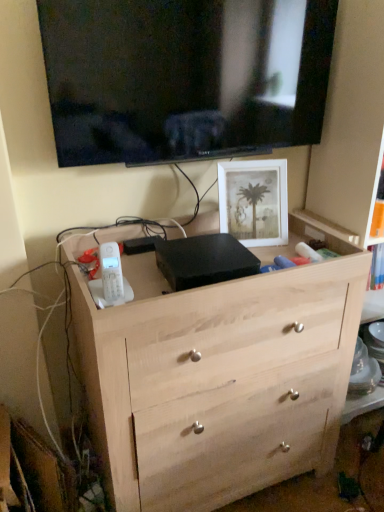
Question: Considering the relative sizes of natural wood chest of drawers at center and white matte picture frame at upper right in the image provided, is natural wood chest of drawers at center bigger than white matte picture frame at upper right?

Choices:
 (A) no
 (B) yes

Answer: (B)

Question: Is natural wood chest of drawers at center positioned with its back to white matte picture frame at upper right?

Choices:
 (A) no
 (B) yes

Answer: (A)

Question: Does natural wood chest of drawers at center have a greater height compared to white matte picture frame at upper right?

Choices:
 (A) yes
 (B) no

Answer: (A)

Question: Is natural wood chest of drawers at center aimed at white matte picture frame at upper right?

Choices:
 (A) yes
 (B) no

Answer: (B)

Question: From a real-world perspective, is natural wood chest of drawers at center over white matte picture frame at upper right?

Choices:
 (A) no
 (B) yes

Answer: (A)

Question: Based on their positions, is white matte picture frame at upper right located to the left or right of black glossy tv at upper center?

Choices:
 (A) left
 (B) right

Answer: (B)

Question: Considering the positions of white matte picture frame at upper right and black glossy tv at upper center in the image, is white matte picture frame at upper right wider or thinner than black glossy tv at upper center?

Choices:
 (A) wide
 (B) thin

Answer: (A)

Question: Is point (x=279, y=189) closer or farther from the camera than point (x=261, y=34)?

Choices:
 (A) closer
 (B) farther

Answer: (B)

Question: In terms of height, does white matte picture frame at upper right look taller or shorter compared to black glossy tv at upper center?

Choices:
 (A) tall
 (B) short

Answer: (B)

Question: In terms of height, does black glossy tv at upper center look taller or shorter compared to white matte picture frame at upper right?

Choices:
 (A) tall
 (B) short

Answer: (A)

Question: Is point (289, 58) positioned closer to the camera than point (268, 207)?

Choices:
 (A) farther
 (B) closer

Answer: (B)

Question: In terms of width, does black glossy tv at upper center look wider or thinner when compared to white matte picture frame at upper right?

Choices:
 (A) wide
 (B) thin

Answer: (B)

Question: Based on their positions, is black glossy tv at upper center located to the left or right of white matte picture frame at upper right?

Choices:
 (A) left
 (B) right

Answer: (A)

Question: Is point tap(48, 38) closer or farther from the camera than point tap(299, 312)?

Choices:
 (A) closer
 (B) farther

Answer: (A)

Question: From their relative heights in the image, would you say black glossy tv at upper center is taller or shorter than natural wood chest of drawers at center?

Choices:
 (A) short
 (B) tall

Answer: (A)